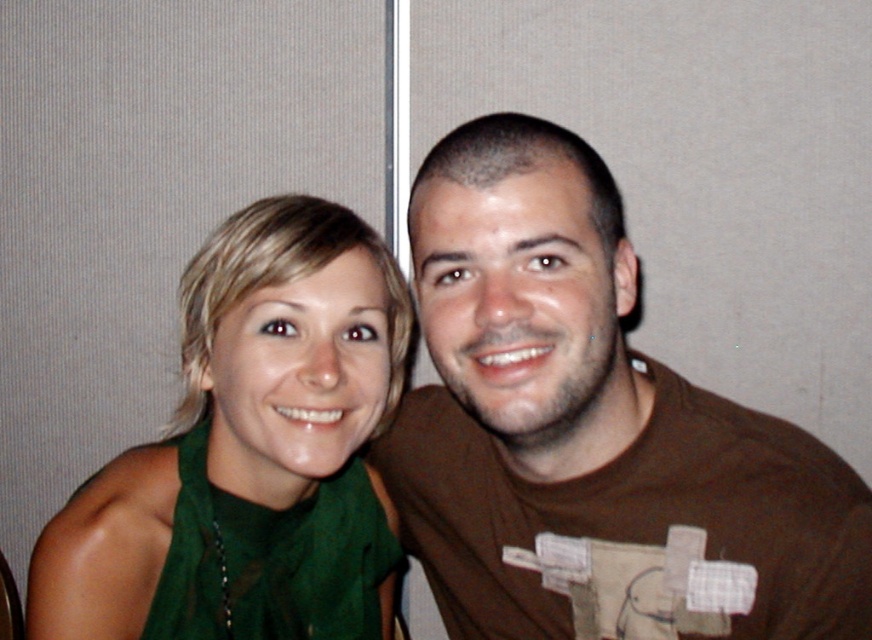
You are standing in front of the two people in the image. There is a point at coordinates (591, 432). Which object from the scene does this point belong to?

The point at coordinates (591, 432) is on the brown cotton t shirt at center.